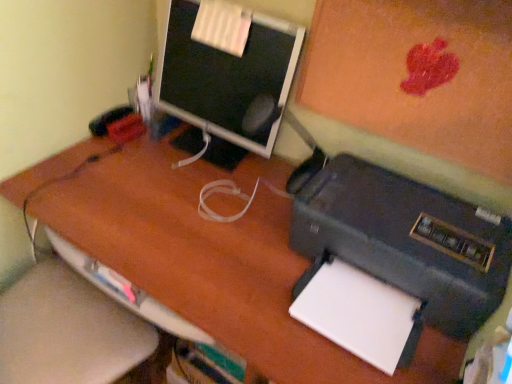
I want to click on vacant space that is to the left of black matte printer at lower right, so click(x=192, y=242).